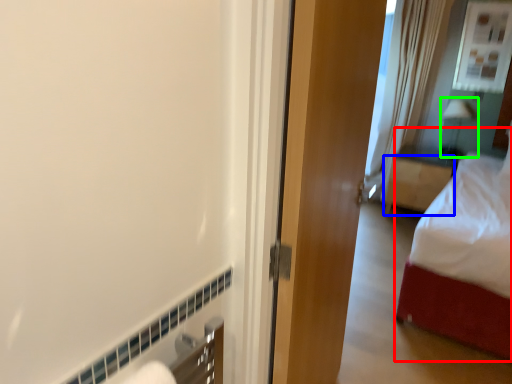
Question: Which object is positioned farthest from bed (highlighted by a red box)? Select from furniture (highlighted by a blue box) and lamp (highlighted by a green box).

Choices:
 (A) furniture
 (B) lamp

Answer: (B)